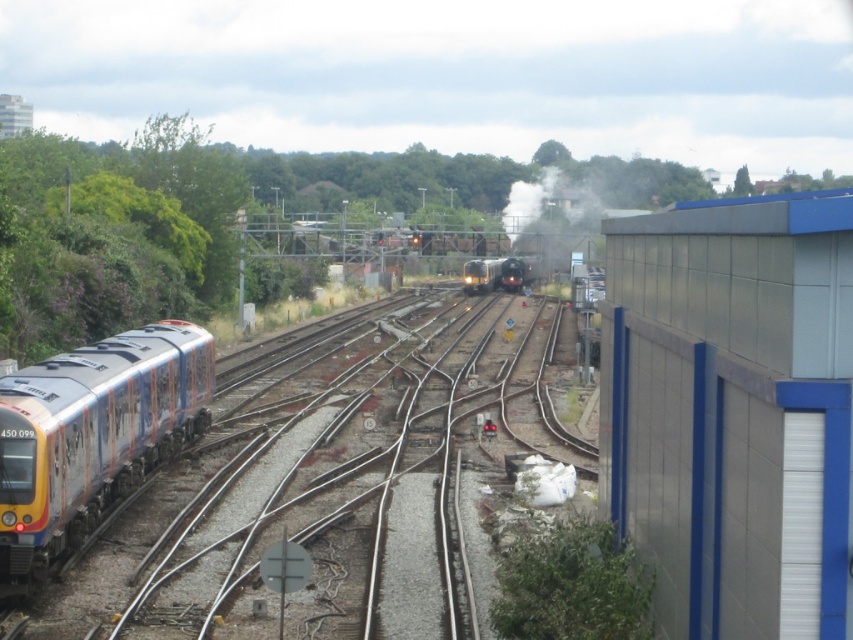
You are a railway engineer inspecting the tracks. You notice the metallic train tracks at left and the shiny black train at center. Which object is positioned lower in the image?

The metallic train tracks at left are positioned lower than the shiny black train at center in the image.

You are a train engineer observing the railway junction. You need to determine the relative positions of the metallic gray building at right and the polished metallic train at left. From your vantage point, which object is positioned higher in the image?

The metallic gray building at right is above the polished metallic train at left, so the metallic gray building at right is positioned higher in the image.

You are a railway engineer inspecting the tracks. You notice the metallic train tracks at left and the shiny black train at center. Which object is lower in height?

The metallic train tracks at left are lower in height compared to the shiny black train at center.